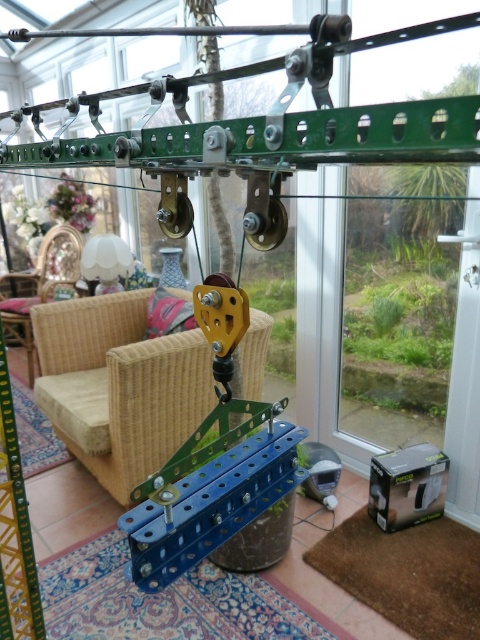
You are organizing a space for a child and need to place a toy box between the metallic blue pulley at center and the wicker armchair at center. According to the scene, which object should the toy box be closer to?

The metallic blue pulley at center is to the right of the wicker armchair at center, so the toy box should be placed closer to the wicker armchair at center to be between them.

You are standing in the conservatory and want to sit down. Which armchair, the rattan armchair at center or the wicker armchair at center, is closer to you?

The rattan armchair at center is closer to you than the wicker armchair at center.